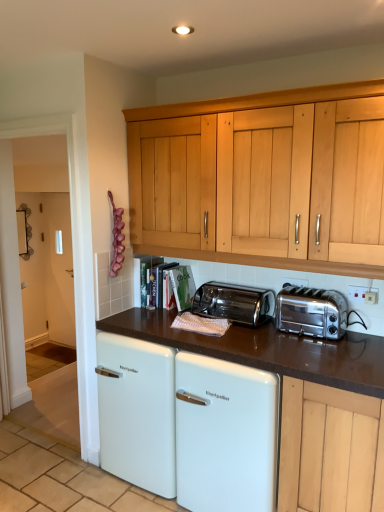
Question: Can you see white plastic electrical outlet at upper right, which is the first electric outlet in right-to-left order, touching satin chrome toaster at right, acting as the second toaster starting from the left?

Choices:
 (A) no
 (B) yes

Answer: (A)

Question: Is white plastic electrical outlet at upper right, which ranks as the second electric outlet in left-to-right order, positioned before satin chrome toaster at right, acting as the second toaster starting from the left?

Choices:
 (A) no
 (B) yes

Answer: (A)

Question: Considering the relative sizes of white plastic electrical outlet at upper right, which ranks as the second electric outlet in left-to-right order, and satin chrome toaster at right, marked as the first toaster in a right-to-left arrangement, in the image provided, is white plastic electrical outlet at upper right, which ranks as the second electric outlet in left-to-right order, smaller than satin chrome toaster at right, marked as the first toaster in a right-to-left arrangement,?

Choices:
 (A) no
 (B) yes

Answer: (B)

Question: Considering the relative sizes of white plastic electrical outlet at upper right, positioned as the first electric outlet in front-to-back order, and satin chrome toaster at right, acting as the second toaster starting from the left, in the image provided, is white plastic electrical outlet at upper right, positioned as the first electric outlet in front-to-back order, bigger than satin chrome toaster at right, acting as the second toaster starting from the left,?

Choices:
 (A) no
 (B) yes

Answer: (A)

Question: Does white plastic electrical outlet at upper right, which is the first electric outlet in right-to-left order, have a greater height compared to satin chrome toaster at right, acting as the second toaster starting from the left?

Choices:
 (A) yes
 (B) no

Answer: (B)

Question: From a real-world perspective, is white plastic electrical outlet at upper right, which ranks as the second electric outlet in left-to-right order, located higher than satin chrome toaster at right, acting as the second toaster starting from the left?

Choices:
 (A) yes
 (B) no

Answer: (A)

Question: Is polished stainless steel toaster at center, placed as the 2th toaster when sorted from right to left, completely or partially inside transparent glass door at left?

Choices:
 (A) yes
 (B) no

Answer: (B)

Question: Is polished stainless steel toaster at center, placed as the 2th toaster when sorted from right to left, at the back of transparent glass door at left?

Choices:
 (A) yes
 (B) no

Answer: (B)

Question: Is transparent glass door at left wider than polished stainless steel toaster at center, placed as the first toaster when sorted from left to right?

Choices:
 (A) no
 (B) yes

Answer: (A)

Question: Does transparent glass door at left appear on the right side of polished stainless steel toaster at center, placed as the 2th toaster when sorted from right to left?

Choices:
 (A) yes
 (B) no

Answer: (B)

Question: Does transparent glass door at left have a lesser width compared to polished stainless steel toaster at center, placed as the 2th toaster when sorted from right to left?

Choices:
 (A) yes
 (B) no

Answer: (A)

Question: Are transparent glass door at left and polished stainless steel toaster at center, placed as the first toaster when sorted from left to right, located far from each other?

Choices:
 (A) yes
 (B) no

Answer: (B)

Question: Is white plastic electrical outlet at upper right, which appears as the second electric outlet when viewed from the back, turned away from transparent glass door at left?

Choices:
 (A) no
 (B) yes

Answer: (A)